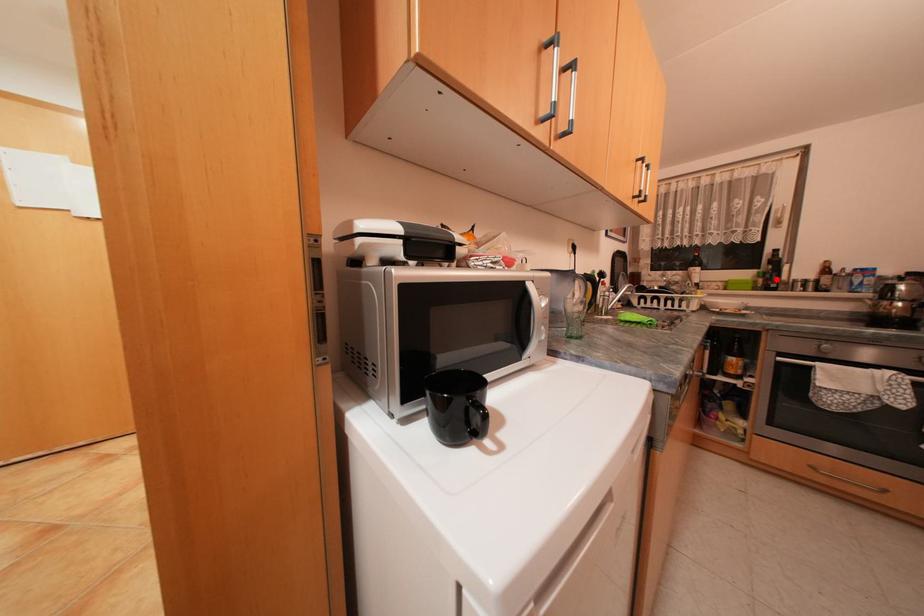
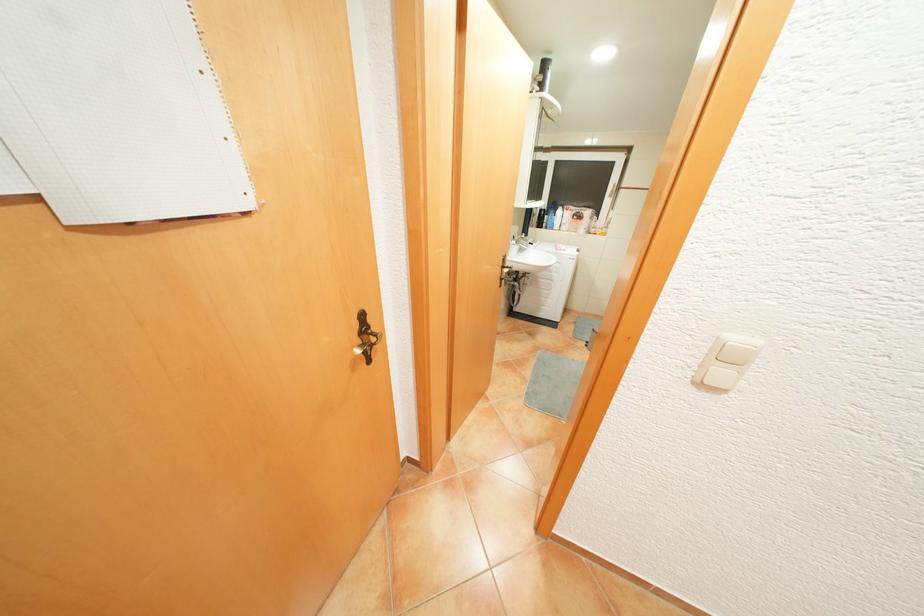
Question: I am providing you with two images of the same scene from different viewpoints. A red point is marked on the first image. Is the red point's position out of view in image 2?

Choices:
 (A) Yes
 (B) No

Answer: (A)